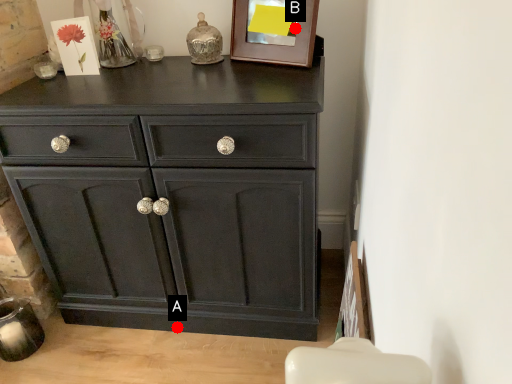
Question: Two points are circled on the image, labeled by A and B beside each circle. Which point is farther to the camera?

Choices:
 (A) A is further
 (B) B is further

Answer: (A)